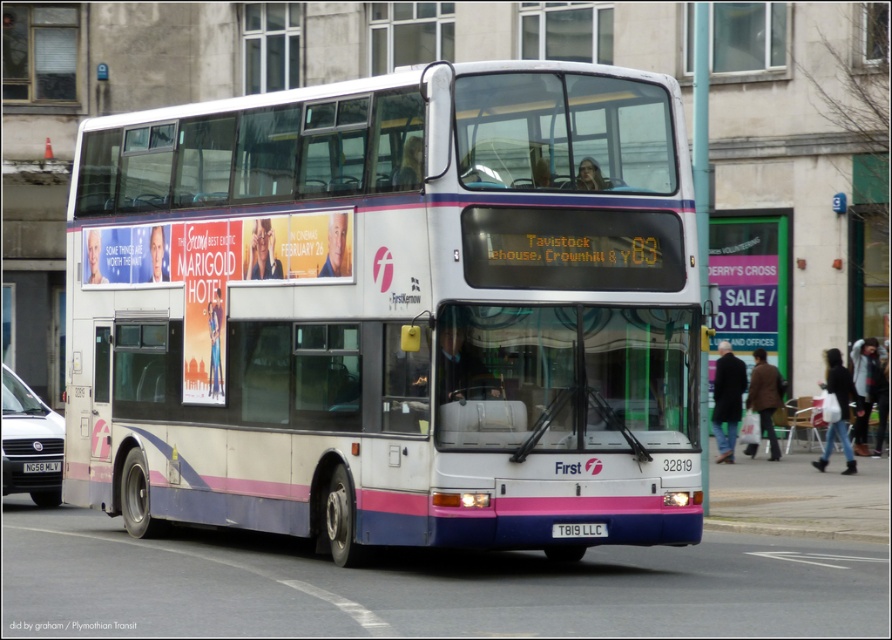
You are standing at the point marked by coordinates (392,310) in the image. What object are you directly at the center of?

The point marked by coordinates (392,310) is at the center of the white matte deck bus.